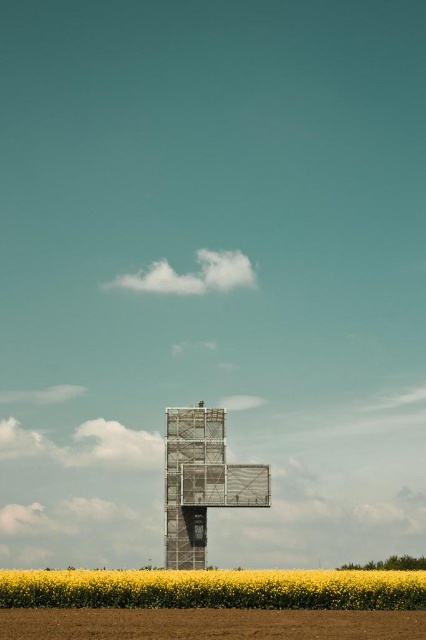
Question: Which object is farther from the camera taking this photo?

Choices:
 (A) scaffolding metal cross at center
 (B) yellow matte flower at lower center

Answer: (A)

Question: Which of the following is the farthest from the observer?

Choices:
 (A) (394, 596)
 (B) (193, 612)

Answer: (A)

Question: From the image, what is the correct spatial relationship of brown soil at lower center in relation to scaffolding metal cross at center?

Choices:
 (A) right
 (B) left

Answer: (B)

Question: Based on their relative distances, which object is farther from the scaffolding metal cross at center?

Choices:
 (A) brown soil at lower center
 (B) yellow matte flower at lower center

Answer: (A)

Question: Is yellow matte flower at lower center above brown soil at lower center?

Choices:
 (A) yes
 (B) no

Answer: (B)

Question: Can you confirm if brown soil at lower center is positioned to the right of scaffolding metal cross at center?

Choices:
 (A) no
 (B) yes

Answer: (A)